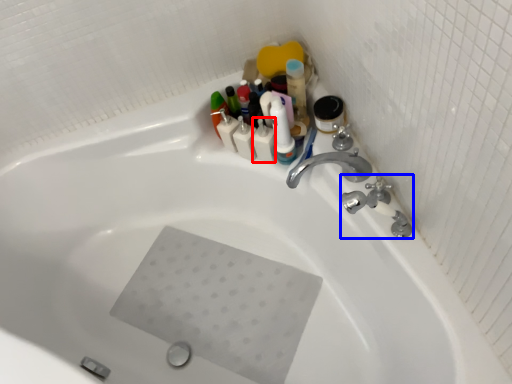
Question: Which object is closer to the camera taking this photo, toiletry (highlighted by a red box) or plumbing fixture (highlighted by a blue box)?

Choices:
 (A) toiletry
 (B) plumbing fixture

Answer: (B)